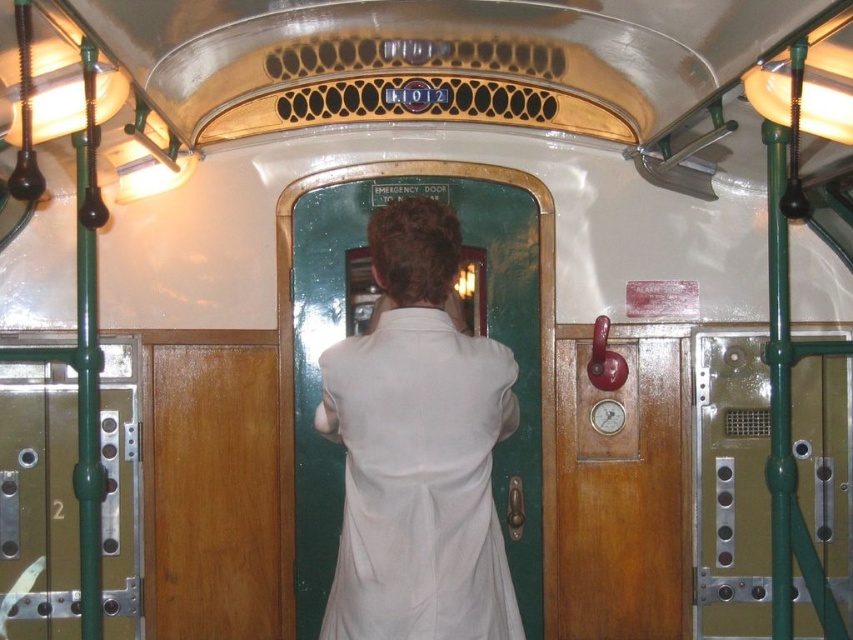
Question: Among these points, which one is nearest to the camera?

Choices:
 (A) (577, 586)
 (B) (422, 346)

Answer: (B)

Question: From the image, what is the correct spatial relationship of white matte dress at center in relation to brown wooden door at right?

Choices:
 (A) above
 (B) below

Answer: (A)

Question: Observing the image, what is the correct spatial positioning of white matte dress at center in reference to brown wooden door at right?

Choices:
 (A) above
 (B) below

Answer: (A)

Question: Which of the following is the closest to the observer?

Choices:
 (A) brown wooden door at right
 (B) white matte dress at center

Answer: (B)

Question: Among these points, which one is farthest from the camera?

Choices:
 (A) (618, 627)
 (B) (422, 385)

Answer: (A)

Question: Is the position of white matte dress at center less distant than that of brown wooden door at right?

Choices:
 (A) yes
 (B) no

Answer: (A)